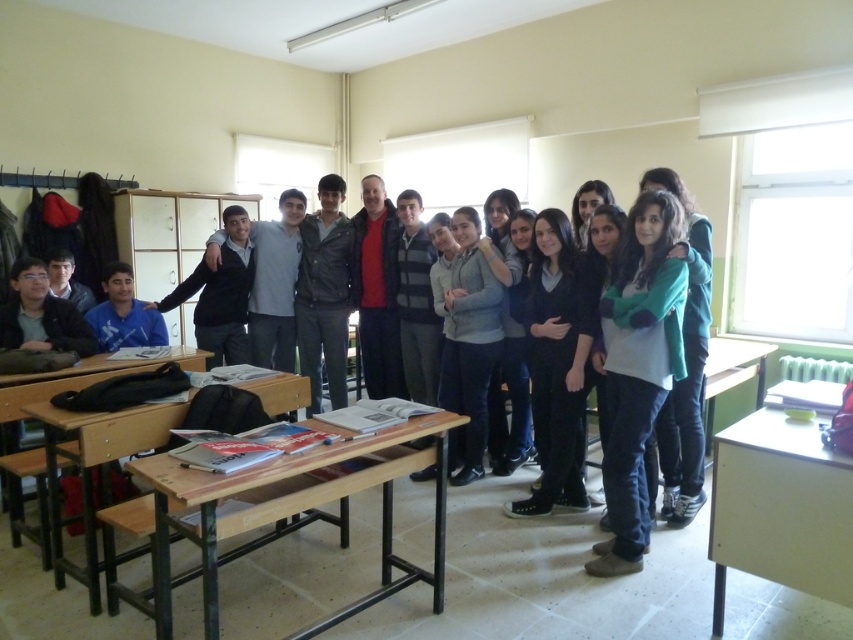
The image size is (853, 640). Identify the location of light wood table at right. (780, 508).

Measure the distance between light wood table at right and camera.

light wood table at right is 2.17 meters from camera.

Who is more distant from viewer, [715,568] or [708,416]?

The point [708,416] is more distant.

Image resolution: width=853 pixels, height=640 pixels. In order to click on light wood table at right in this screenshot , I will do `click(780, 508)`.

Is point (312, 630) more distant than point (718, 605)?

No, (312, 630) is in front of (718, 605).

Who is higher up, wooden table at center or light wood table at right?

wooden table at center is higher up.

Locate an element on the screen. wooden table at center is located at coordinates (294, 506).

Which is behind, point (91, 429) or point (717, 364)?

Positioned behind is point (717, 364).

What do you see at coordinates (96, 465) in the screenshot? I see `wooden desk at lower left` at bounding box center [96, 465].

Where is `wooden desk at lower left`? The width and height of the screenshot is (853, 640). wooden desk at lower left is located at coordinates (96, 465).